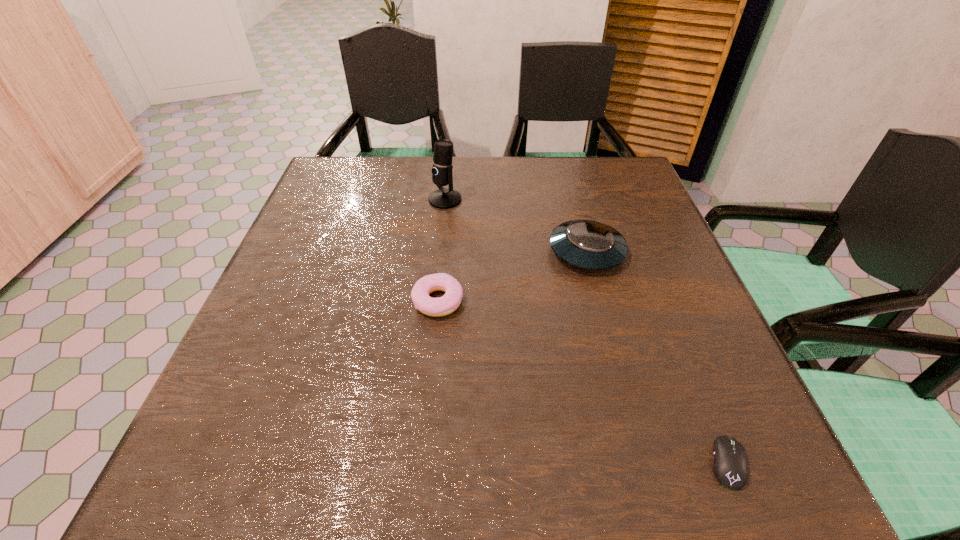
Locate an element on the screen. Image resolution: width=960 pixels, height=540 pixels. free region located 0.260m on the front of the second shortest object is located at coordinates (423, 455).

This screenshot has height=540, width=960. Find the location of `vacant space situated on the back of the nearest object`. vacant space situated on the back of the nearest object is located at coordinates (689, 366).

Image resolution: width=960 pixels, height=540 pixels. I want to click on object that is at the far edge, so click(442, 198).

I want to click on object that is at the near edge, so click(x=730, y=467).

You are a GUI agent. You are given a task and a screenshot of the screen. Output one action in this format:
    pyautogui.click(x=<x>, y=<y>)
    Task: Click on the saucer situated at the right edge
    
    Given the screenshot: What is the action you would take?
    pyautogui.click(x=586, y=244)

Locate an element on the screen. This screenshot has height=540, width=960. computer equipment at the right edge is located at coordinates (730, 467).

Find the location of `object at the near right corner`. object at the near right corner is located at coordinates (730, 467).

Image resolution: width=960 pixels, height=540 pixels. I want to click on free space at the far edge of the desktop, so tap(531, 186).

This screenshot has width=960, height=540. Find the location of `vacant space at the near edge`. vacant space at the near edge is located at coordinates (344, 461).

Identify the location of vacant area at the left edge of the desktop. The width and height of the screenshot is (960, 540). (324, 330).